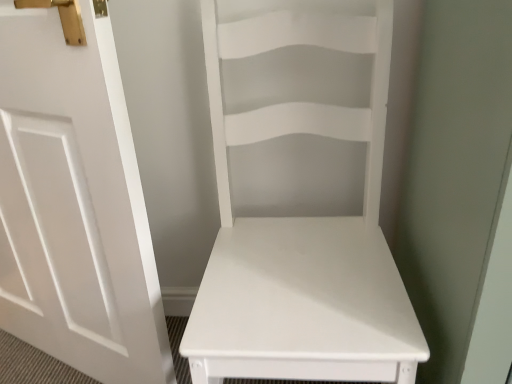
Question: From a real-world perspective, is white matte door at left physically located above or below white matte chair at center?

Choices:
 (A) below
 (B) above

Answer: (B)

Question: Is white matte door at left inside the boundaries of white matte chair at center, or outside?

Choices:
 (A) inside
 (B) outside

Answer: (B)

Question: Considering the positions of white matte door at left and white matte chair at center in the image, is white matte door at left taller or shorter than white matte chair at center?

Choices:
 (A) tall
 (B) short

Answer: (A)

Question: From the image's perspective, is white matte chair at center positioned above or below white matte door at left?

Choices:
 (A) below
 (B) above

Answer: (A)

Question: Considering their positions, is white matte chair at center located in front of or behind white matte door at left?

Choices:
 (A) front
 (B) behind

Answer: (A)

Question: In the image, is white matte chair at center on the left side or the right side of white matte door at left?

Choices:
 (A) left
 (B) right

Answer: (B)

Question: Is point (236, 56) positioned closer to the camera than point (92, 163)?

Choices:
 (A) farther
 (B) closer

Answer: (A)